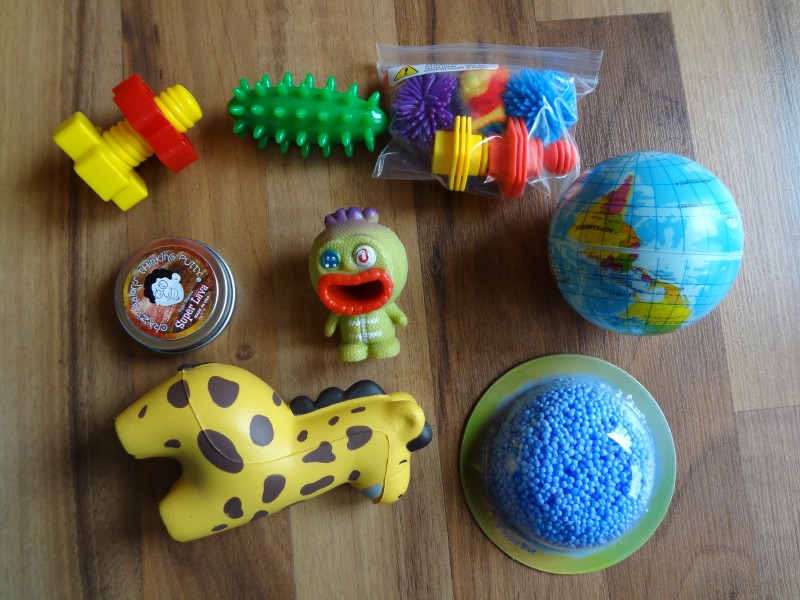
Locate an element on the screen. children's toys is located at coordinates (258, 452), (178, 275), (133, 143), (338, 123), (352, 256), (492, 109), (658, 249), (573, 456).